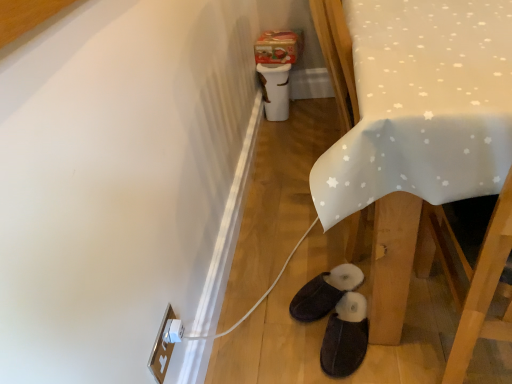
You are a GUI agent. You are given a task and a screenshot of the screen. Output one action in this format:
    pyautogui.click(x=<x>, y=<y>)
    Task: Click on the vacant space positioned to the left of dark brown suede slippers at lower center, the 1th footwear in the front-to-back sequence
    
    Given the screenshot: What is the action you would take?
    pyautogui.click(x=282, y=342)